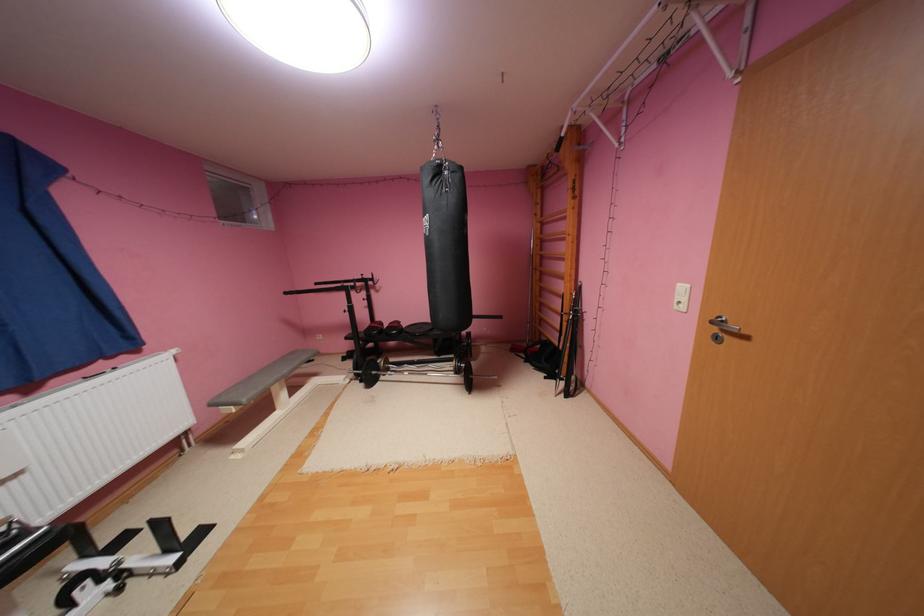
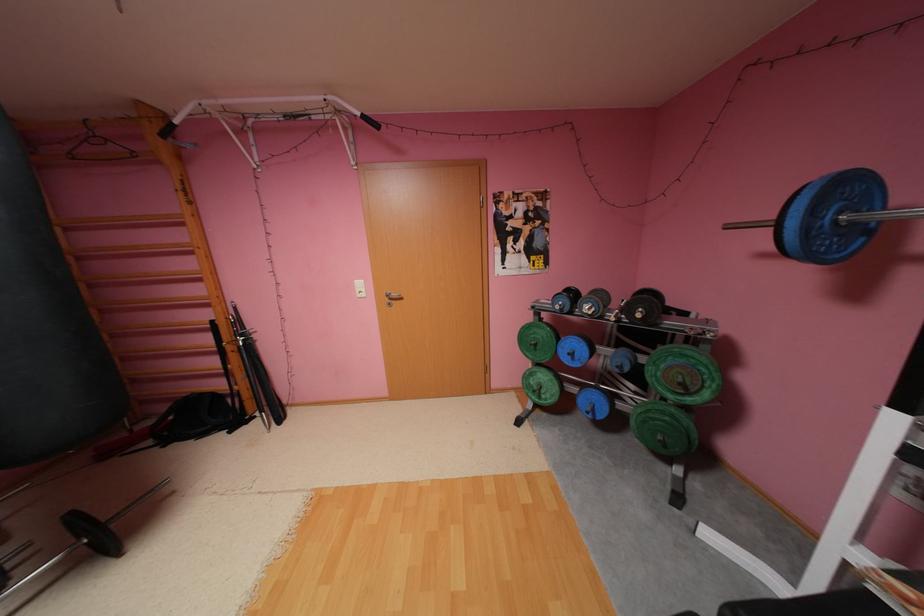
Locate, in the second image, the point that corresponds to point 578,284 in the first image.

(227, 308)